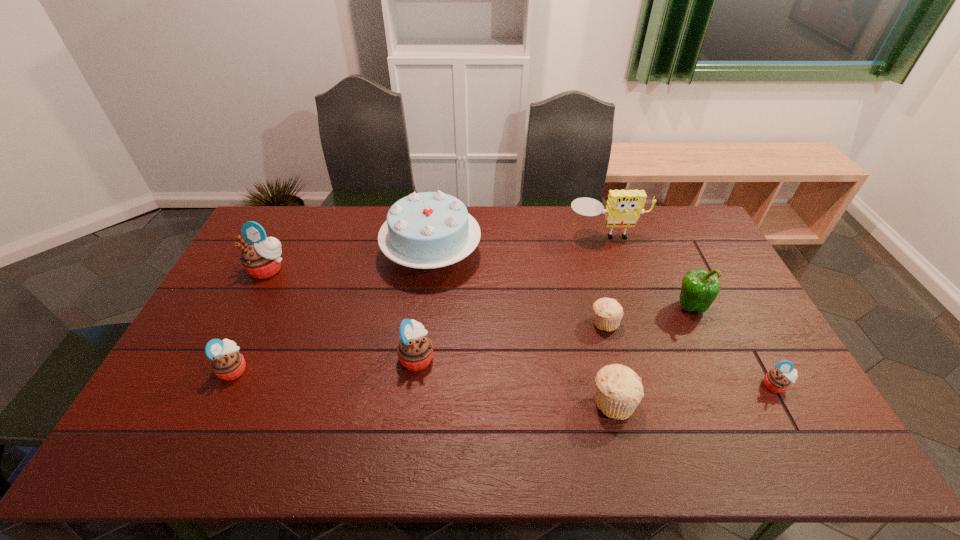
Locate an element on the screen. This screenshot has width=960, height=540. birthday cake is located at coordinates (425, 230).

Where is `sponge`? The image size is (960, 540). sponge is located at coordinates tap(624, 207).

You are a GUI agent. You are given a task and a screenshot of the screen. Output one action in this format:
    pyautogui.click(x=<x>, y=<y>)
    Task: Click on the farthest pink muffin
    
    Given the screenshot: What is the action you would take?
    pyautogui.click(x=261, y=259)

You are a GUI agent. You are given a task and a screenshot of the screen. Output one action in this format:
    pyautogui.click(x=<x>, y=<y>)
    Task: Click on the tallest muffin
    The image size is (960, 540).
    Given the screenshot: What is the action you would take?
    pyautogui.click(x=261, y=259)

Image resolution: width=960 pixels, height=540 pixels. What are the coordinates of `green bell pepper` in the screenshot? It's located at (699, 289).

Image resolution: width=960 pixels, height=540 pixels. I want to click on the fourth muffin from right to left, so click(x=415, y=350).

I want to click on the second tallest muffin, so click(x=415, y=350).

You are a GUI agent. You are given a task and a screenshot of the screen. Output one action in this format:
    pyautogui.click(x=<x>, y=<y>)
    Task: Click on the third biggest pink muffin
    
    Given the screenshot: What is the action you would take?
    pyautogui.click(x=227, y=364)

Find the location of a particular element. This screenshot has height=540, width=960. the bigger beige muffin is located at coordinates (619, 390).

Locate an element on the screen. the rightmost muffin is located at coordinates (778, 380).